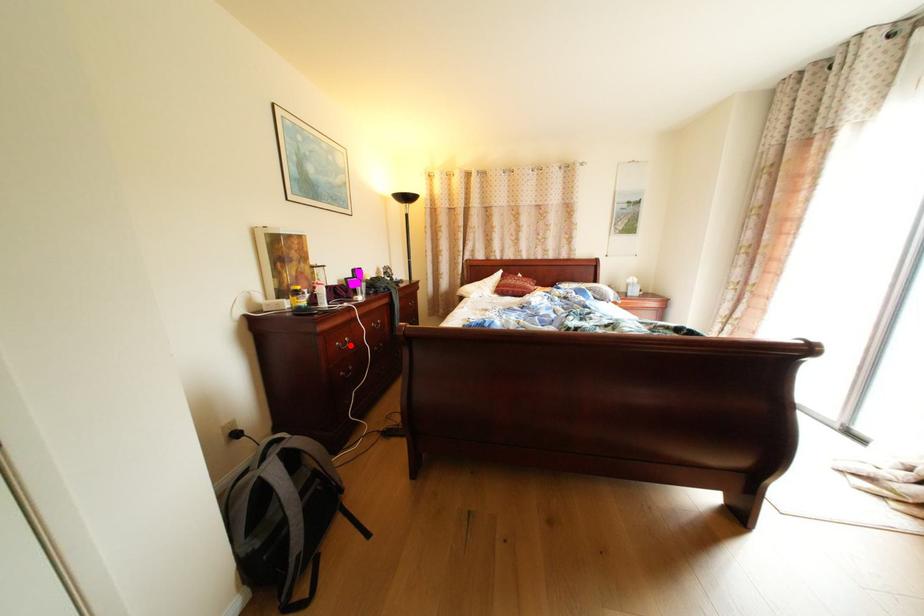
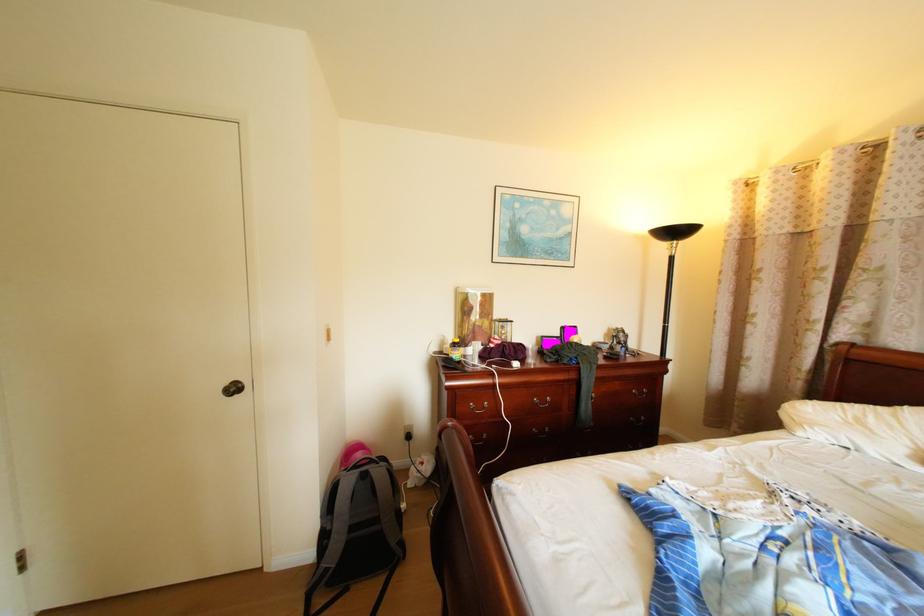
Question: I am providing you with two images of the same scene from different viewpoints. Given a red point in image1, look at the same physical point in image2. Is it:

Choices:
 (A) Closer to the viewpoint
 (B) Farther from the viewpoint

Answer: (B)